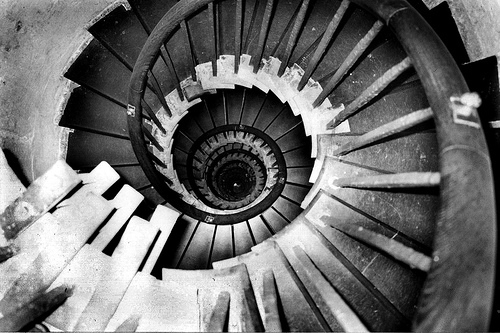
Locate an element on the screen. This screenshot has height=333, width=500. banister is located at coordinates (142, 58).